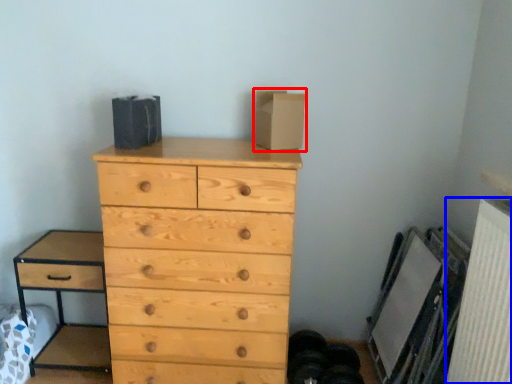
Question: Which of the following is the closest to the observer, cardboard box (highlighted by a red box) or radiator (highlighted by a blue box)?

Choices:
 (A) cardboard box
 (B) radiator

Answer: (B)